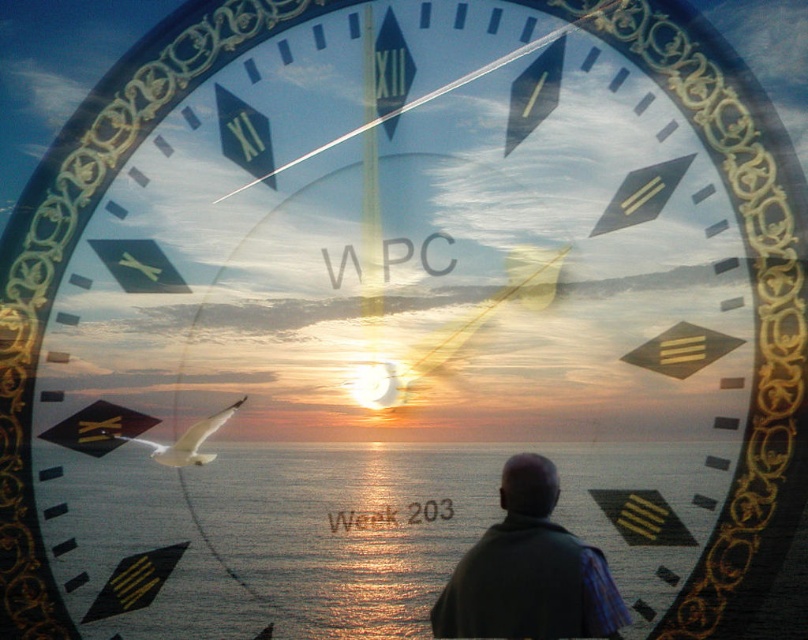
Is dark gray fabric at center to the right of white feathered bird at center from the viewer's perspective?

Yes, dark gray fabric at center is to the right of white feathered bird at center.

At what (x,y) coordinates should I click in order to perform the action: click on dark gray fabric at center. Please return your answer as a coordinate pair (x, y). The image size is (808, 640). Looking at the image, I should click on (529, 570).

At what (x,y) coordinates should I click in order to perform the action: click on dark gray fabric at center. Please return your answer as a coordinate pair (x, y). The height and width of the screenshot is (640, 808). Looking at the image, I should click on (529, 570).

Between glistening ocean water at center and white feathered bird at center, which one appears on the left side from the viewer's perspective?

white feathered bird at center

Does glistening ocean water at center have a lesser height compared to white feathered bird at center?

No, glistening ocean water at center is not shorter than white feathered bird at center.

You are a GUI agent. You are given a task and a screenshot of the screen. Output one action in this format:
    pyautogui.click(x=<x>, y=<y>)
    Task: Click on the glistening ocean water at center
    
    Given the screenshot: What is the action you would take?
    pyautogui.click(x=350, y=531)

This screenshot has width=808, height=640. In order to click on glistening ocean water at center in this screenshot , I will do `click(350, 531)`.

Describe the element at coordinates (350, 531) in the screenshot. Image resolution: width=808 pixels, height=640 pixels. I see `glistening ocean water at center` at that location.

Does glistening ocean water at center come behind dark gray fabric at center?

Yes.

Is point (351, 493) in front of point (537, 512)?

No, (351, 493) is behind (537, 512).

Locate an element on the screen. The image size is (808, 640). glistening ocean water at center is located at coordinates (350, 531).